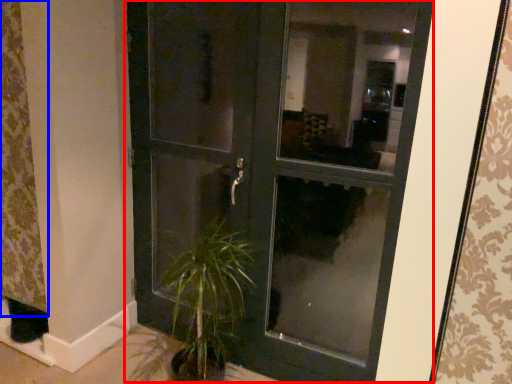
Question: Among these objects, which one is nearest to the camera, door (highlighted by a red box) or curtain (highlighted by a blue box)?

Choices:
 (A) door
 (B) curtain

Answer: (A)